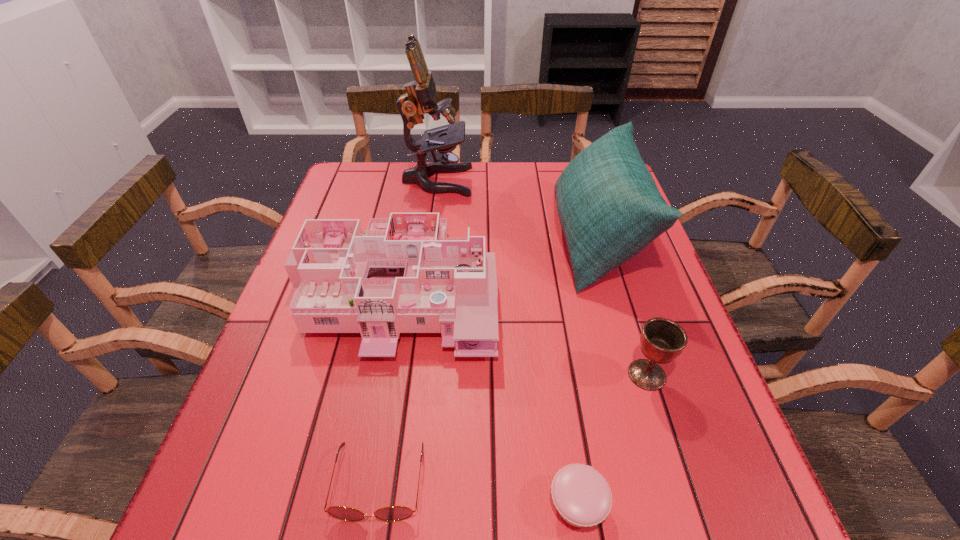
The image size is (960, 540). In order to click on vacant area situated at the front entrance of the dollhouse in this screenshot , I will do `click(375, 395)`.

Where is `free space located on the front of the chalice`? Image resolution: width=960 pixels, height=540 pixels. free space located on the front of the chalice is located at coordinates (685, 495).

The height and width of the screenshot is (540, 960). I want to click on vacant space located on the back of the cupcake, so click(548, 310).

The image size is (960, 540). I want to click on microscope that is positioned at the far edge, so click(420, 98).

Locate an element on the screen. cushion present at the far edge is located at coordinates (609, 206).

Locate an element on the screen. This screenshot has width=960, height=540. sunglasses located at the near edge is located at coordinates (393, 513).

Find the location of `cupcake that is at the near edge`. cupcake that is at the near edge is located at coordinates (583, 498).

Locate an element on the screen. This screenshot has width=960, height=540. object situated at the left edge is located at coordinates (408, 275).

You are a GUI agent. You are given a task and a screenshot of the screen. Output one action in this format:
    pyautogui.click(x=<x>, y=<y>)
    Task: Click on the cushion at the right edge
    The image size is (960, 540).
    Given the screenshot: What is the action you would take?
    [x=609, y=206]

In order to click on chalice that is at the right edge in this screenshot , I will do `click(662, 340)`.